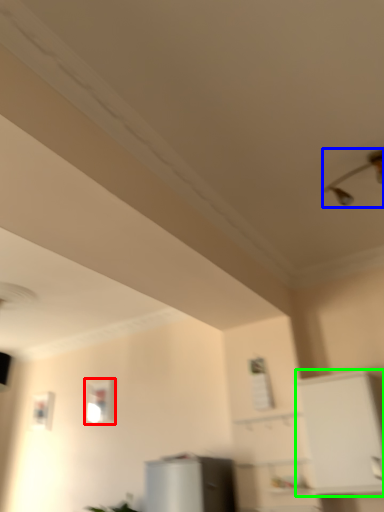
Question: Considering the real-world distances, which object is farthest from window (highlighted by a red box)? light fixture (highlighted by a blue box) or cabinetry (highlighted by a green box)?

Choices:
 (A) light fixture
 (B) cabinetry

Answer: (A)